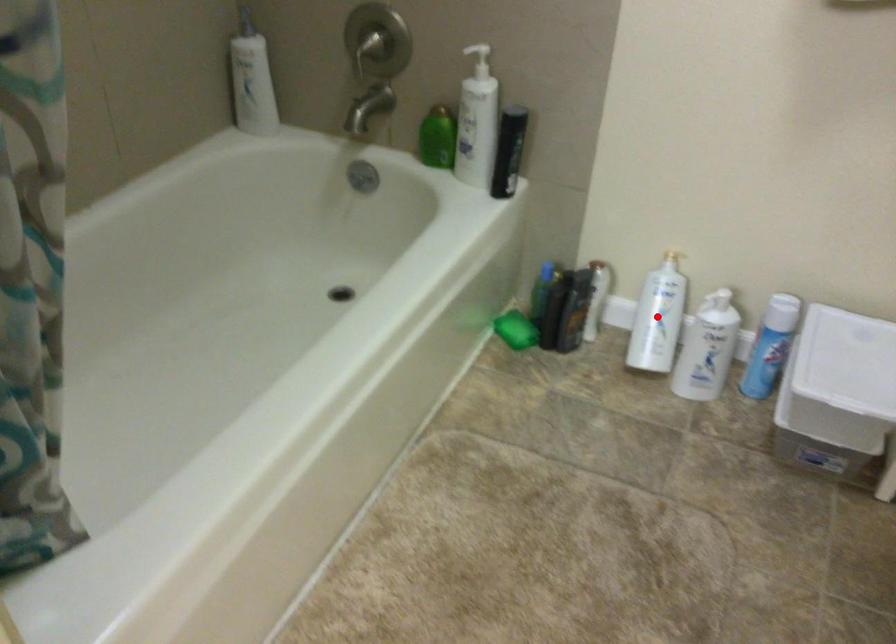
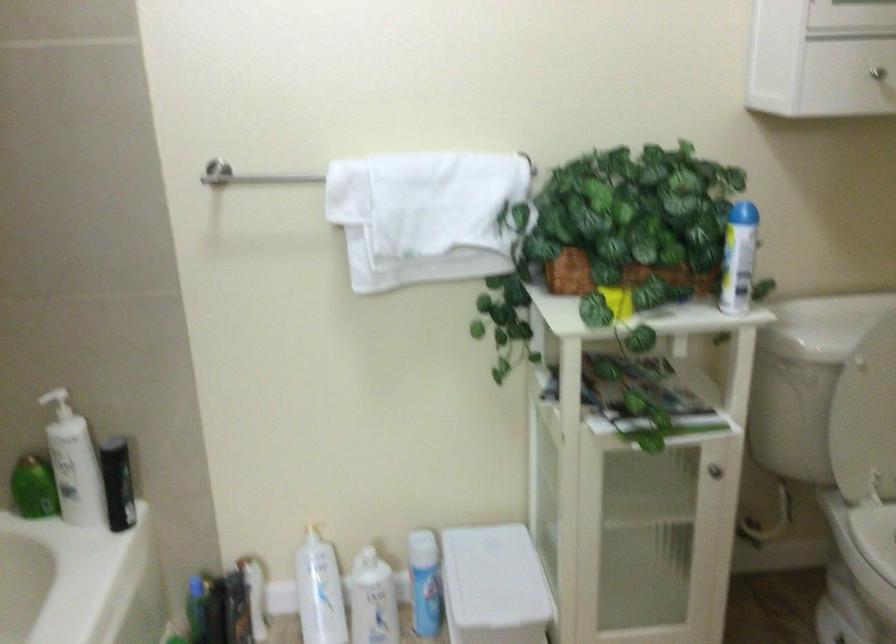
In the second image, find the point that corresponds to the highlighted location in the first image.

(319, 591)